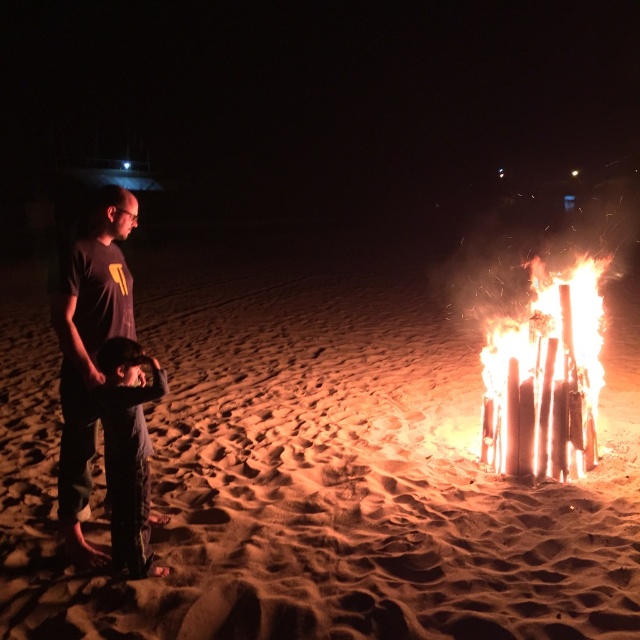
Is bright orange wood at right closer to camera compared to dark gray t-shirt at left?

No, bright orange wood at right is further to the viewer.

Can you confirm if bright orange wood at right is positioned to the left of dark gray t-shirt at left?

In fact, bright orange wood at right is to the right of dark gray t-shirt at left.

Image resolution: width=640 pixels, height=640 pixels. I want to click on bright orange wood at right, so click(545, 376).

Is bright orange wood at right closer to camera compared to dark gray pants at lower left?

No, it is not.

Is bright orange wood at right smaller than dark gray pants at lower left?

Yes.

Between point (488, 444) and point (129, 353), which one is positioned in front?

Point (129, 353) is more forward.

Locate an element on the screen. The width and height of the screenshot is (640, 640). bright orange wood at right is located at coordinates (545, 376).

What do you see at coordinates (88, 344) in the screenshot? The width and height of the screenshot is (640, 640). I see `dark gray t-shirt at left` at bounding box center [88, 344].

Between point (84, 513) and point (125, 442), which one is positioned in front?

Positioned in front is point (125, 442).

At what (x,y) coordinates should I click in order to perform the action: click on dark gray t-shirt at left. Please return your answer as a coordinate pair (x, y). The height and width of the screenshot is (640, 640). Looking at the image, I should click on (88, 344).